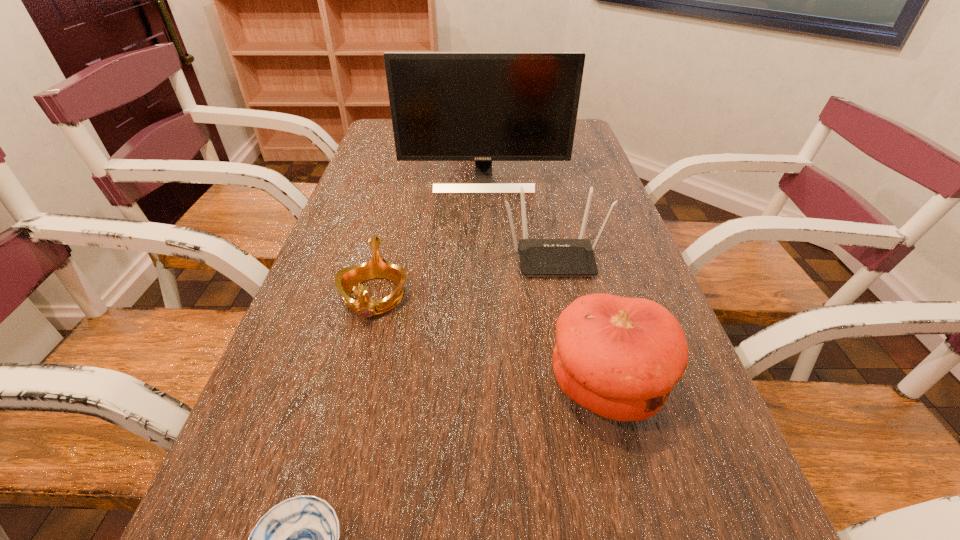
Where is `monitor that is at the left edge`? The height and width of the screenshot is (540, 960). monitor that is at the left edge is located at coordinates point(445,106).

The width and height of the screenshot is (960, 540). Find the location of `tiara that is positioned at the left edge`. tiara that is positioned at the left edge is located at coordinates (346, 280).

You are a GUI agent. You are given a task and a screenshot of the screen. Output one action in this format:
    pyautogui.click(x=<x>, y=<y>)
    Task: Click on the monitor present at the right edge
    Image resolution: width=960 pixels, height=540 pixels.
    Given the screenshot: What is the action you would take?
    pyautogui.click(x=445, y=106)

The image size is (960, 540). In order to click on pumpkin that is positioned at the right edge in this screenshot , I will do pos(619,357).

Locate an element on the screen. router situated at the right edge is located at coordinates (538, 257).

Locate an element on the screen. The width and height of the screenshot is (960, 540). free region at the left edge of the desktop is located at coordinates (317, 423).

In the image, there is a desktop. Where is `vacant space at the right edge`? vacant space at the right edge is located at coordinates (663, 507).

Identify the location of free space at the far left corner of the desktop. (381, 134).

This screenshot has width=960, height=540. In order to click on vacant region at the far right corner of the desktop in this screenshot , I will do `click(578, 119)`.

Where is `free space between the farthest object and the router`? This screenshot has height=540, width=960. free space between the farthest object and the router is located at coordinates (519, 218).